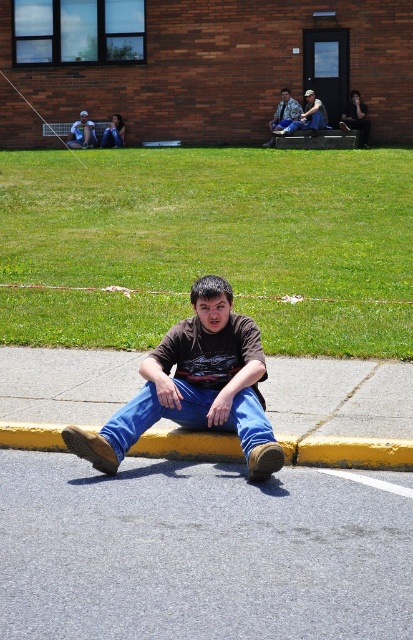
You are a drone operator trying to capture a photo of the two points in the scene. The camera is positioned at the same level as the points. Which point, point (204, 538) or point (220, 429), will appear larger in the photo?

Point (204, 538) is closer to the camera than point (220, 429), so it will appear larger in the photo.

You are a hiker who wants to place your denim jacket at upper center on the green grass at center. Will the jacket be visible once placed there?

The green grass at center is taller than the denim jacket at upper center, so the jacket will be hidden by the grass when placed there.

You are standing at the edge of the road where the young man is sitting. If you look down, which object would you see first between the gray asphalt at lower center and the blue denim jeans at center?

The blue denim jeans at center would be seen first because the gray asphalt at lower center is located below it, meaning the jeans are positioned higher up in the visual field.